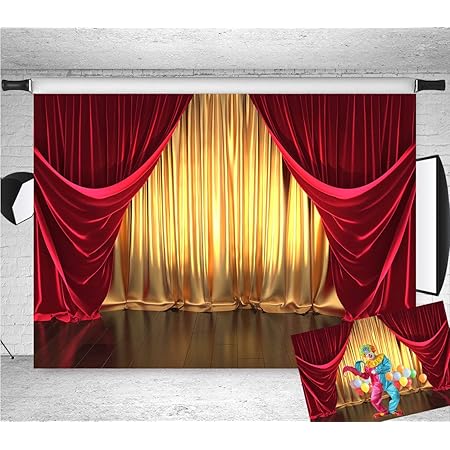
Identify the location of backdrop. The height and width of the screenshot is (450, 450). (222, 231).